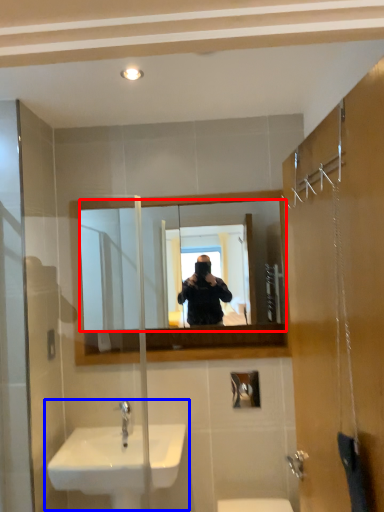
Question: Which point is closer to the camera, mirror (highlighted by a red box) or sink (highlighted by a blue box)?

Choices:
 (A) mirror
 (B) sink

Answer: (B)